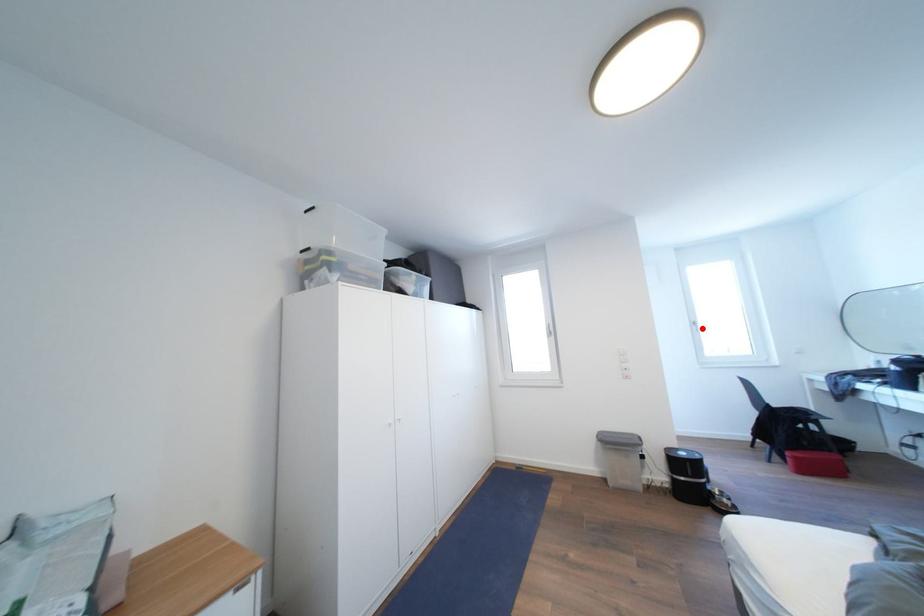
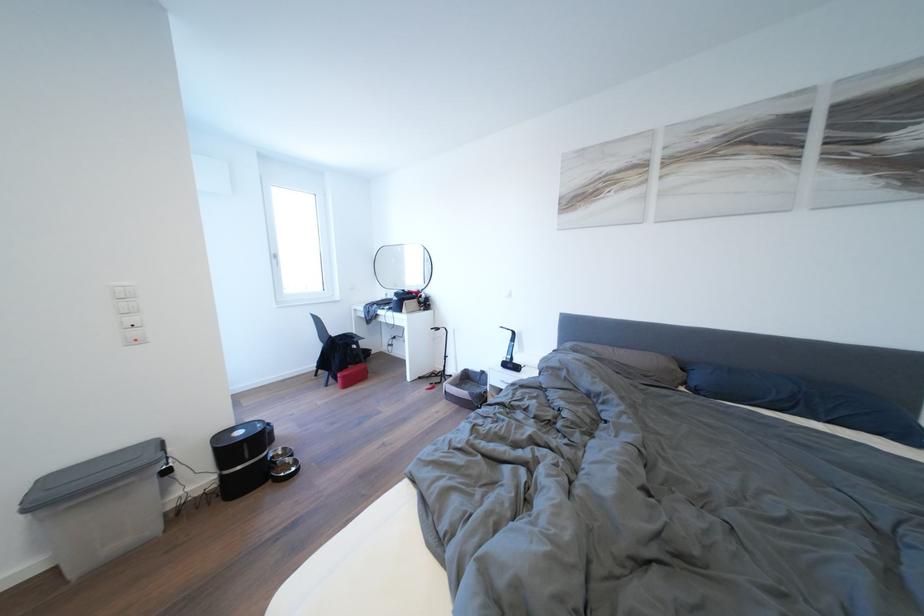
Find the pixel in the second image that matches the highlighted location in the first image.

(284, 261)